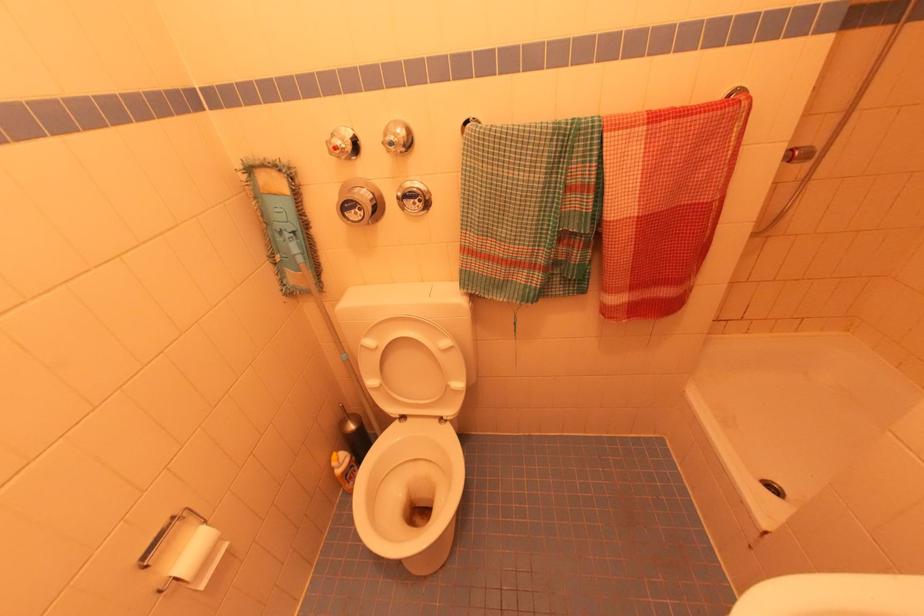
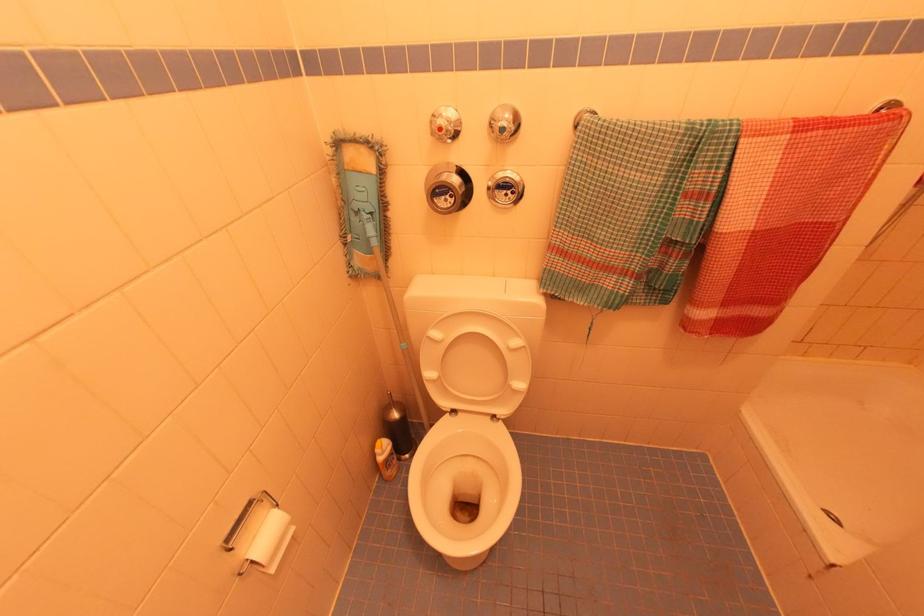
The point at [663,111] is marked in the first image. Where is the corresponding point in the second image?

(812, 122)